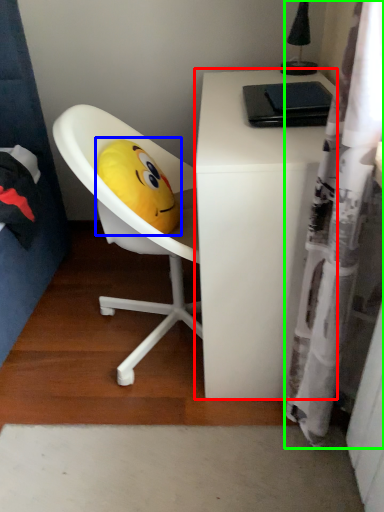
Question: Which object is positioned closest to desk (highlighted by a red box)? Select from toy (highlighted by a blue box) and shower curtain (highlighted by a green box).

Choices:
 (A) toy
 (B) shower curtain

Answer: (B)